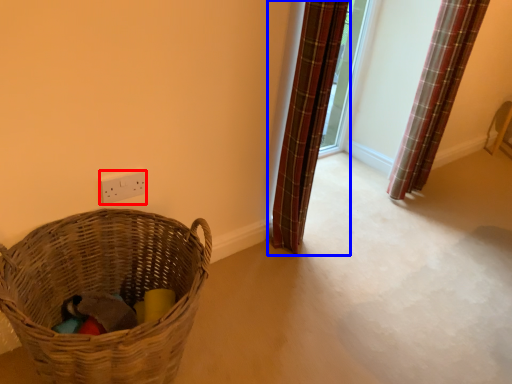
Question: Among these objects, which one is farthest to the camera, electric outlet (highlighted by a red box) or curtain (highlighted by a blue box)?

Choices:
 (A) electric outlet
 (B) curtain

Answer: (A)